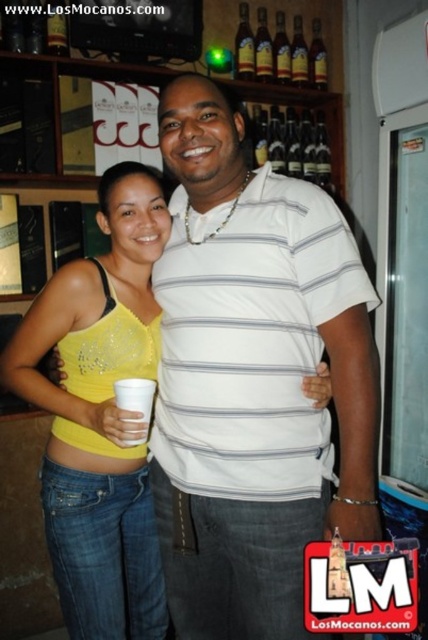
Question: Estimate the real-world distances between objects in this image. Which object is farther from the clear glass wine at upper center?

Choices:
 (A) white paper cup at lower left
 (B) brown glass bottles at upper center
 (C) yellow sequined tank top at center

Answer: (A)

Question: Estimate the real-world distances between objects in this image. Which object is farther from the yellow sequined tank top at center?

Choices:
 (A) white striped shirt at center
 (B) brown glass bottle at upper center

Answer: (B)

Question: Among these points, which one is nearest to the camera?

Choices:
 (A) (x=131, y=397)
 (B) (x=252, y=49)
 (C) (x=290, y=140)
 (D) (x=300, y=38)

Answer: (A)

Question: Can you confirm if yellow sequined tank top at center is bigger than brown glass bottle at upper center?

Choices:
 (A) no
 (B) yes

Answer: (B)

Question: Is brown glass bottles at upper center wider than clear glass wine at upper center?

Choices:
 (A) no
 (B) yes

Answer: (B)

Question: From the image, what is the correct spatial relationship of white striped shirt at center in relation to yellow sequined tank top at center?

Choices:
 (A) right
 (B) left

Answer: (A)